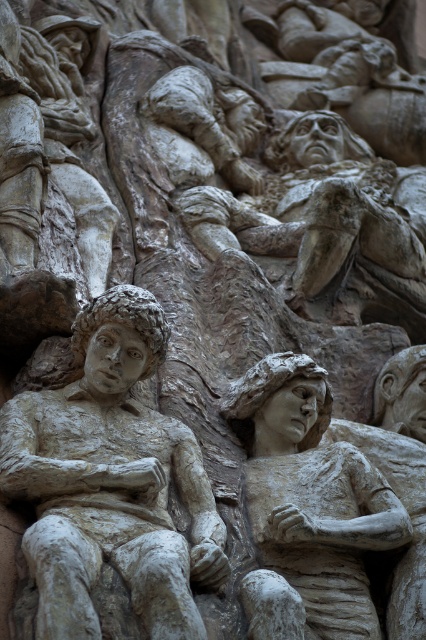
Question: Which point appears closest to the camera in this image?

Choices:
 (A) (199, 522)
 (B) (267, 461)

Answer: (A)

Question: Can you confirm if white stone figure at center is smaller than matte stone figure at center?

Choices:
 (A) no
 (B) yes

Answer: (A)

Question: Which object is farther from the camera taking this photo?

Choices:
 (A) white stone figure at center
 (B) matte stone figure at center

Answer: (B)

Question: Considering the relative positions of white stone figure at center and matte stone figure at center in the image provided, where is white stone figure at center located with respect to matte stone figure at center?

Choices:
 (A) left
 (B) right

Answer: (A)

Question: Does white stone figure at center have a greater width compared to matte stone figure at center?

Choices:
 (A) yes
 (B) no

Answer: (A)

Question: Which point is closer to the camera?

Choices:
 (A) (262, 488)
 (B) (218, 545)

Answer: (B)